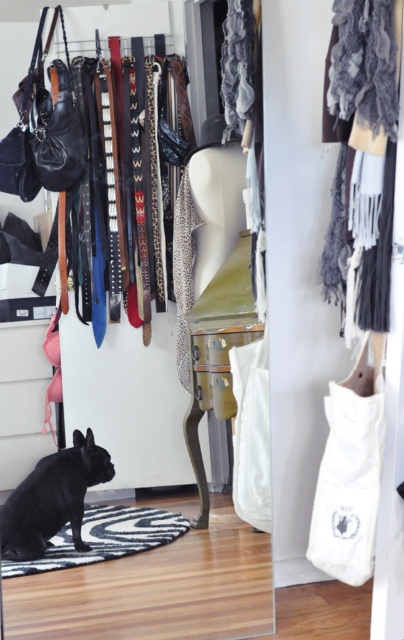
Question: Which object appears closest to the camera in this image?

Choices:
 (A) white canvas bag at lower right
 (B) white fabric bag at center
 (C) black matte dog at lower left
 (D) zebra-patterned rug at lower left

Answer: (A)

Question: Is white canvas bag at lower right positioned before black matte dog at lower left?

Choices:
 (A) yes
 (B) no

Answer: (A)

Question: Considering the real-world distances, which object is closest to the black matte dog at lower left?

Choices:
 (A) white canvas bag at lower right
 (B) zebra-patterned rug at lower left

Answer: (B)

Question: Which point is closer to the camera?

Choices:
 (A) (326, 486)
 (B) (239, 496)
 (C) (100, 529)
 (D) (35, 545)

Answer: (A)

Question: Does black matte dog at lower left have a larger size compared to white fabric bag at center?

Choices:
 (A) yes
 (B) no

Answer: (A)

Question: Does white canvas bag at lower right appear on the right side of zebra-patterned rug at lower left?

Choices:
 (A) no
 (B) yes

Answer: (B)